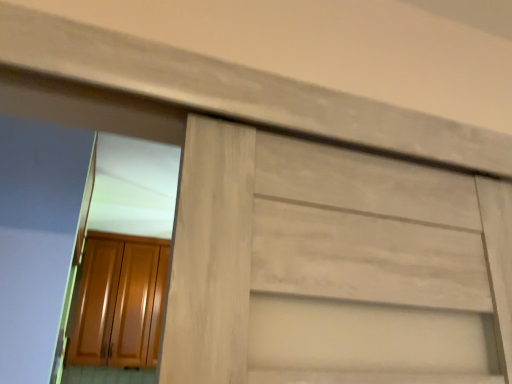
Question: Should I look upward or downward to see glossy wood cabinet at lower left?

Choices:
 (A) up
 (B) down

Answer: (B)